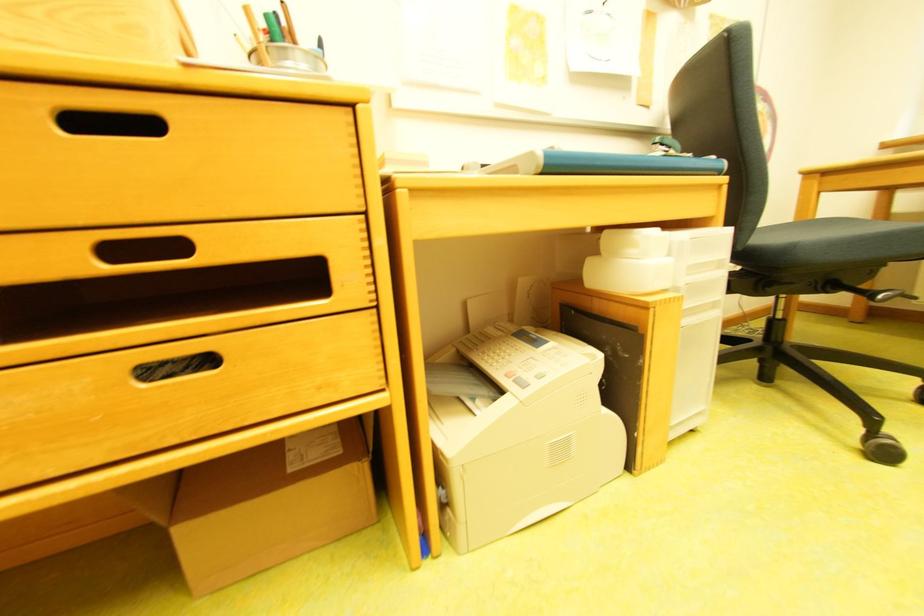
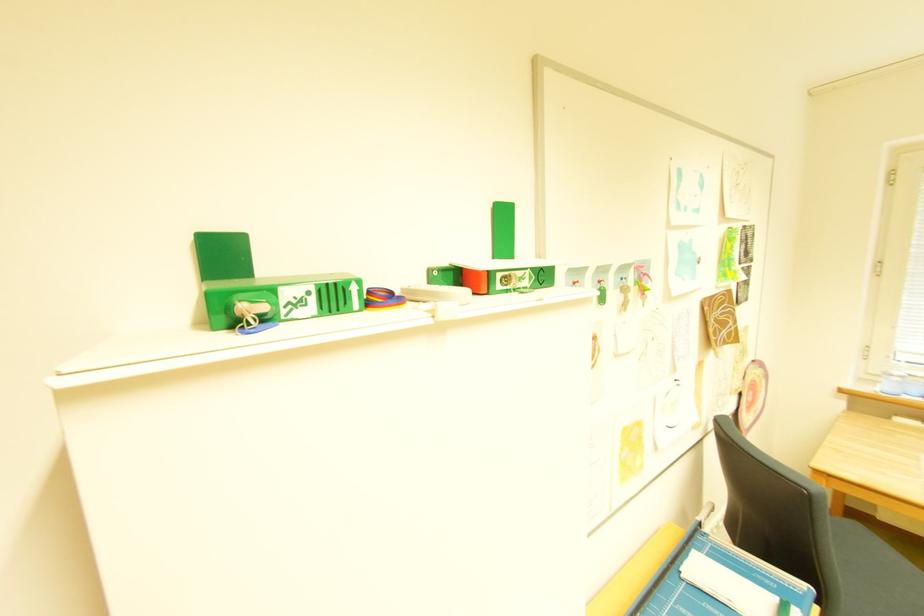
Question: In a continuous first-person perspective shot, in which direction is the camera moving?

Choices:
 (A) Left
 (B) Right
 (C) Forward
 (D) Backward

Answer: (A)